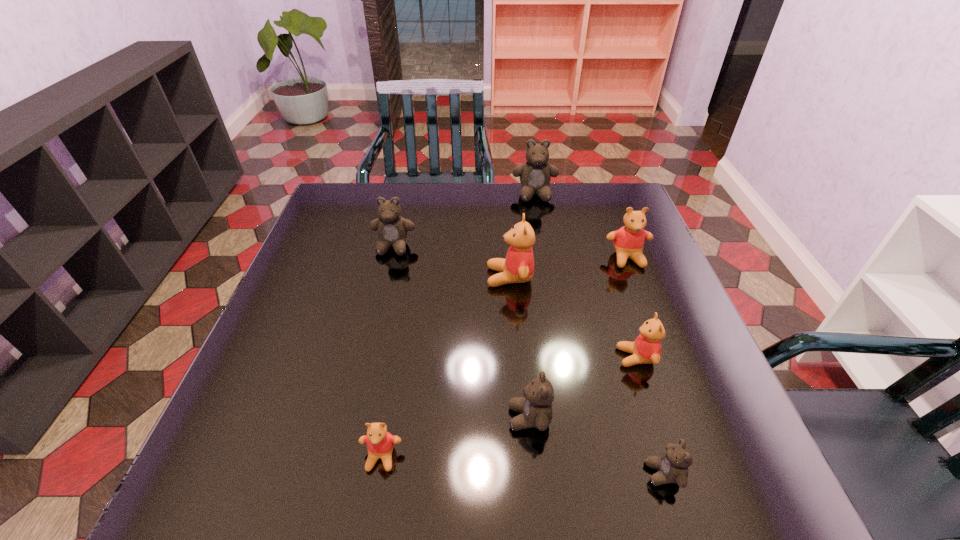
Locate an element on the screen. The image size is (960, 540). the smallest brown teddy bear is located at coordinates (672, 467).

At what (x,y) coordinates should I click in order to perform the action: click on the smallest red teddy bear. Please return your answer as a coordinate pair (x, y). The width and height of the screenshot is (960, 540). Looking at the image, I should click on (380, 443).

Find the location of `the nearest red teddy bear`. the nearest red teddy bear is located at coordinates (380, 443).

In order to click on vacant space located 0.050m on the face of the farthest brown teddy bear in this screenshot , I will do `click(538, 213)`.

Where is `vacant space situated on the front-facing side of the second red teddy bear from left to right`? The image size is (960, 540). vacant space situated on the front-facing side of the second red teddy bear from left to right is located at coordinates (395, 277).

Image resolution: width=960 pixels, height=540 pixels. Identify the location of blank space located on the front-facing side of the second red teddy bear from left to right. (360, 277).

I want to click on free space located on the front-facing side of the second red teddy bear from left to right, so click(360, 277).

Where is `vacant space located on the face of the third smallest brown teddy bear`? vacant space located on the face of the third smallest brown teddy bear is located at coordinates (378, 312).

Find the location of a particular element. This screenshot has height=540, width=960. vacant area located on the front-facing side of the third smallest red teddy bear is located at coordinates (684, 404).

The width and height of the screenshot is (960, 540). What are the coordinates of `free space located on the front-facing side of the fourth nearest object` in the screenshot? It's located at pyautogui.click(x=438, y=357).